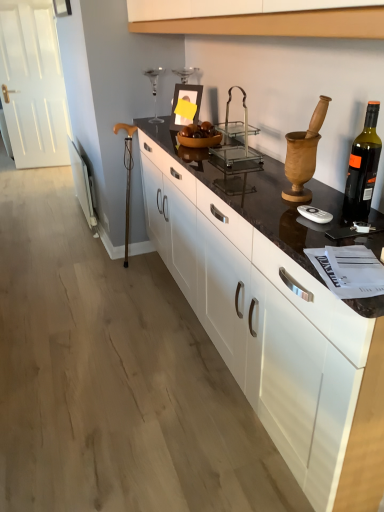
Describe the element at coordinates (363, 168) in the screenshot. This screenshot has height=512, width=384. I see `black glass bottle at right` at that location.

This screenshot has height=512, width=384. Describe the element at coordinates (236, 140) in the screenshot. I see `clear glass trolley at center` at that location.

Locate an element on the screen. The height and width of the screenshot is (512, 384). black marble countertop at center is located at coordinates (274, 324).

Find the location of a particular element. The width and height of the screenshot is (384, 512). black glass bottle at right is located at coordinates (363, 168).

From the image's perspective, does black glass bottle at right appear lower than black marble countertop at center?

No, from the image's perspective, black glass bottle at right is not below black marble countertop at center.

The width and height of the screenshot is (384, 512). What are the coordinates of `bottle behind the black marble countertop at center` in the screenshot? It's located at (363, 168).

Consider the image. Is black glass bottle at right oriented away from black marble countertop at center?

No, black glass bottle at right is not facing the opposite direction of black marble countertop at center.

Are clear glass trolley at center and black marble countertop at center located far from each other?

No, clear glass trolley at center is not far from black marble countertop at center.

Identify the location of appliance lying behind the black marble countertop at center. (236, 140).

What's the angular difference between clear glass trolley at center and black marble countertop at center's facing directions?

There is a 1.05-degree angle between the facing directions of clear glass trolley at center and black marble countertop at center.

Considering the positions of point (320, 503) and point (227, 168), is point (320, 503) closer or farther from the camera than point (227, 168)?

Point (320, 503) appears to be closer to the viewer than point (227, 168).

The height and width of the screenshot is (512, 384). I want to click on appliance above the black marble countertop at center (from the image's perspective), so click(236, 140).

Can you tell me how much black marble countertop at center and clear glass trolley at center differ in facing direction?

The angle between the facing direction of black marble countertop at center and the facing direction of clear glass trolley at center is 1.05 degrees.

Looking at this image, would you say black marble countertop at center is inside or outside clear glass trolley at center?

black marble countertop at center cannot be found inside clear glass trolley at center.

From a real-world perspective, which object rests below the other?

clear glass trolley at center, from a real-world perspective.

Is clear glass trolley at center located outside black glass bottle at right?

That's correct, clear glass trolley at center is outside of black glass bottle at right.

From the image's perspective, who appears lower, clear glass trolley at center or black glass bottle at right?

black glass bottle at right, from the image's perspective.

Consider the image. Which object is closer to the camera taking this photo, clear glass trolley at center or black glass bottle at right?

Positioned in front is black glass bottle at right.

Considering the relative sizes of black marble countertop at center and black glass bottle at right in the image provided, is black marble countertop at center shorter than black glass bottle at right?

In fact, black marble countertop at center may be taller than black glass bottle at right.

Considering the relative positions of black marble countertop at center and black glass bottle at right in the image provided, is black marble countertop at center to the right of black glass bottle at right from the viewer's perspective?

In fact, black marble countertop at center is to the left of black glass bottle at right.

Are black marble countertop at center and black glass bottle at right far apart?

black marble countertop at center is near black glass bottle at right, not far away.

Considering the relative positions of black glass bottle at right and clear glass trolley at center in the image provided, is black glass bottle at right to the left of clear glass trolley at center from the viewer's perspective?

No, black glass bottle at right is not to the left of clear glass trolley at center.

Looking at this image, in terms of size, does black glass bottle at right appear bigger or smaller than clear glass trolley at center?

Considering their sizes, black glass bottle at right takes up less space than clear glass trolley at center.

From a real-world perspective, which object rests below the other?

From a 3D spatial view, clear glass trolley at center is below.

Locate an element on the screen. The height and width of the screenshot is (512, 384). countertop in front of the black glass bottle at right is located at coordinates (274, 324).

Identify the location of appliance above the black marble countertop at center (from the image's perspective). The image size is (384, 512). (236, 140).

Estimate the real-world distances between objects in this image. Which object is further from clear glass trolley at center, black glass bottle at right or black marble countertop at center?

black glass bottle at right is further to clear glass trolley at center.

From the image, which object appears to be farther from black marble countertop at center, clear glass trolley at center or black glass bottle at right?

clear glass trolley at center.

From the image, which object appears to be farther from clear glass trolley at center, black marble countertop at center or black glass bottle at right?

black glass bottle at right is positioned further to the anchor clear glass trolley at center.

Based on the photo, from the image, which object appears to be farther from black glass bottle at right, black marble countertop at center or clear glass trolley at center?

clear glass trolley at center lies further to black glass bottle at right than the other object.

Considering their positions, is black glass bottle at right positioned further to black marble countertop at center than clear glass trolley at center?

The object further to black marble countertop at center is clear glass trolley at center.

When comparing their distances from black glass bottle at right, does clear glass trolley at center or black marble countertop at center seem closer?

black marble countertop at center is positioned closer to the anchor black glass bottle at right.

The image size is (384, 512). I want to click on bottle between black marble countertop at center and clear glass trolley at center from front to back, so click(x=363, y=168).